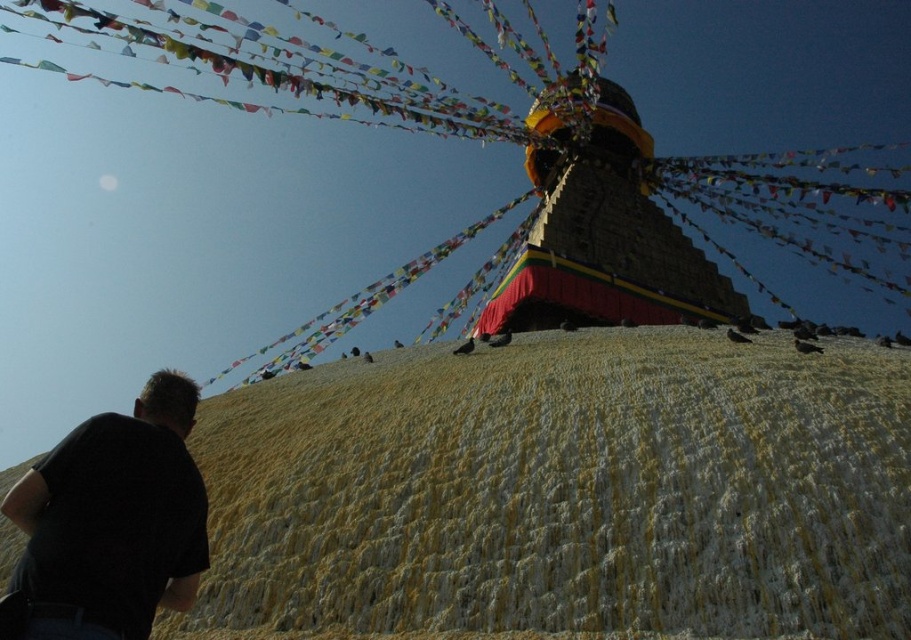
Question: Which of the following is the farthest from the observer?

Choices:
 (A) (718, 484)
 (B) (74, 605)

Answer: (A)

Question: Is yellow textured mound at center positioned behind black cotton shirt at lower left?

Choices:
 (A) no
 (B) yes

Answer: (B)

Question: Is yellow textured mound at center closer to camera compared to black cotton shirt at lower left?

Choices:
 (A) no
 (B) yes

Answer: (A)

Question: Among these objects, which one is farthest from the camera?

Choices:
 (A) black cotton shirt at lower left
 (B) yellow textured mound at center

Answer: (B)

Question: Can you confirm if yellow textured mound at center is positioned to the left of black cotton shirt at lower left?

Choices:
 (A) no
 (B) yes

Answer: (A)